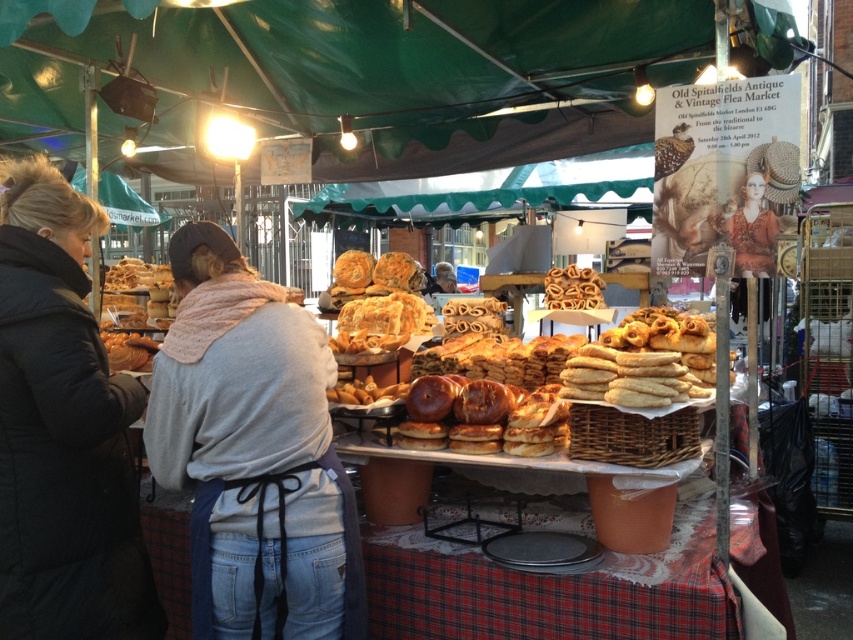
Is golden crispy bread at center to the right of golden brown doughnut at center from the viewer's perspective?

No, golden crispy bread at center is not to the right of golden brown doughnut at center.

Which of these two, golden crispy bread at center or golden brown doughnut at center, stands shorter?

golden brown doughnut at center

Between point (402, 301) and point (602, 282), which one is positioned behind?

The point (602, 282) is more distant.

Find the location of a particular element. This screenshot has width=853, height=640. golden crispy bread at center is located at coordinates (378, 298).

Does point (190, 564) lie behind point (148, 298)?

No, it is not.

Is light gray fleece jacket at center to the right of golden brown bread at left from the viewer's perspective?

Indeed, light gray fleece jacket at center is positioned on the right side of golden brown bread at left.

Where is `light gray fleece jacket at center`? This screenshot has height=640, width=853. light gray fleece jacket at center is located at coordinates (252, 451).

What are the coordinates of `light gray fleece jacket at center` in the screenshot? It's located at (252, 451).

Measure the distance between red plaid fabric at center and golden brown bread at left.

A distance of 2.04 meters exists between red plaid fabric at center and golden brown bread at left.

Does red plaid fabric at center have a smaller size compared to golden brown bread at left?

Yes.

Which is in front, point (573, 593) or point (135, 298)?

Point (573, 593)

The width and height of the screenshot is (853, 640). In order to click on red plaid fabric at center in this screenshot , I will do `click(548, 589)`.